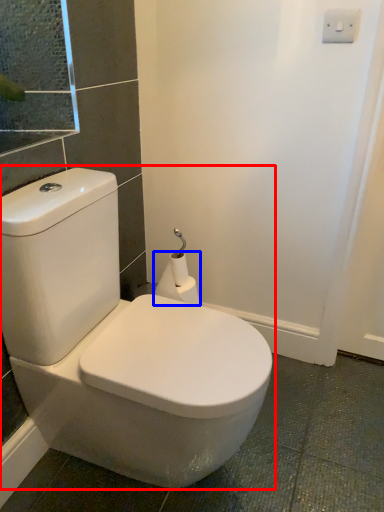
Question: Which object appears farthest to the camera in this image, toilet (highlighted by a red box) or toilet paper (highlighted by a blue box)?

Choices:
 (A) toilet
 (B) toilet paper

Answer: (B)